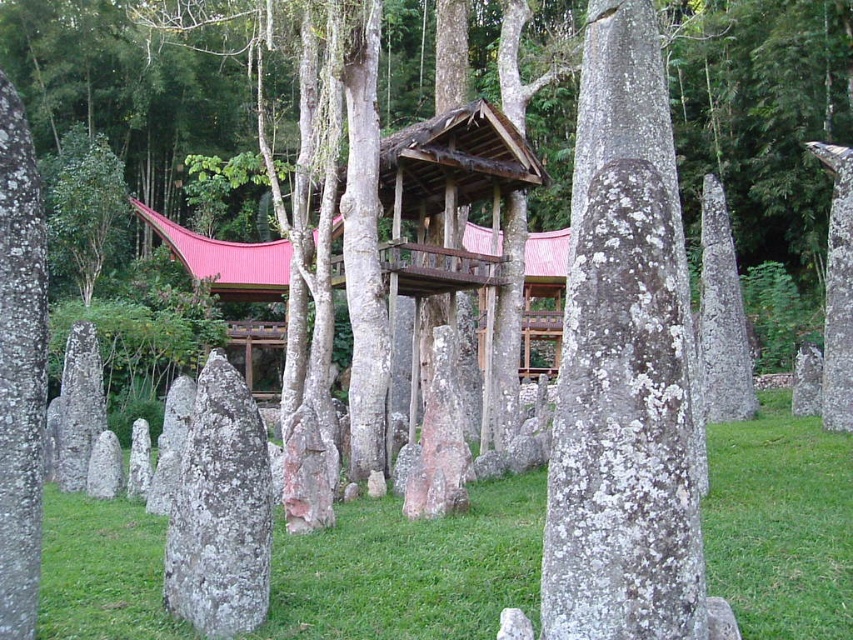
Can you confirm if green leafy tree at left is taller than pinkish-white lichen-covered rock at center?

Indeed, green leafy tree at left has a greater height compared to pinkish-white lichen-covered rock at center.

Which is above, green leafy tree at left or pinkish-white lichen-covered rock at center?

Positioned higher is green leafy tree at left.

I want to click on green leafy tree at left, so click(x=83, y=205).

Where is `green leafy tree at left`? green leafy tree at left is located at coordinates (83, 205).

Does green grass at center come in front of green leafy tree at left?

That is True.

Describe the element at coordinates (410, 568) in the screenshot. I see `green grass at center` at that location.

Locate an element on the screen. The image size is (853, 640). green grass at center is located at coordinates (410, 568).

Is green grass at center positioned behind lichen-covered stone at center?

No, green grass at center is closer to the viewer.

Can you confirm if green grass at center is smaller than lichen-covered stone at center?

No.

Which is in front, point (65, 628) or point (221, 448)?

Positioned in front is point (65, 628).

You are a GUI agent. You are given a task and a screenshot of the screen. Output one action in this format:
    pyautogui.click(x=<x>, y=<y>)
    Task: Click on the green grass at center
    The height and width of the screenshot is (640, 853).
    Given the screenshot: What is the action you would take?
    pyautogui.click(x=410, y=568)